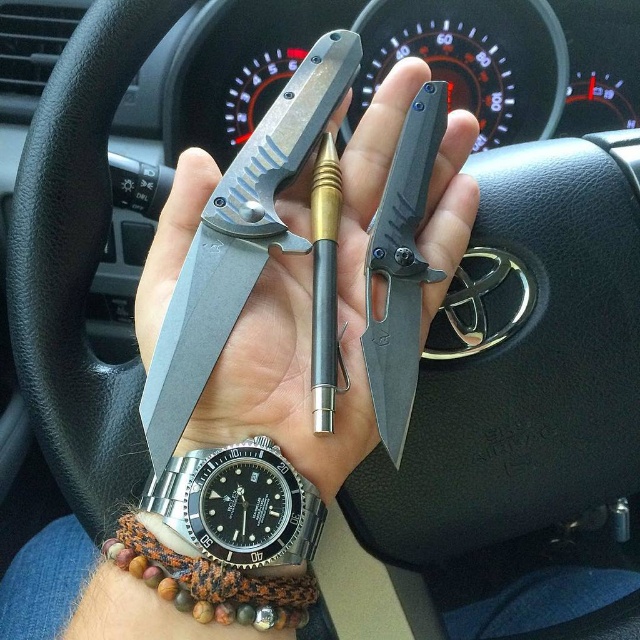
Question: Which object is closer to the camera taking this photo?

Choices:
 (A) black matte knife at center
 (B) satin steel watch at lower left
 (C) matte black knife at center

Answer: (B)

Question: Can you confirm if satin steel watch at lower left is positioned to the right of black matte knife at center?

Choices:
 (A) no
 (B) yes

Answer: (A)

Question: Which of the following is the farthest from the observer?

Choices:
 (A) black matte knife at center
 (B) matte black knife at center
 (C) satin steel watch at lower left

Answer: (A)

Question: Estimate the real-world distances between objects in this image. Which object is closer to the matte black knife at center?

Choices:
 (A) black matte knife at center
 (B) satin steel watch at lower left

Answer: (A)

Question: From the image, what is the correct spatial relationship of satin steel watch at lower left in relation to black matte knife at center?

Choices:
 (A) right
 (B) left

Answer: (B)

Question: Is satin steel watch at lower left positioned behind black matte knife at center?

Choices:
 (A) yes
 (B) no

Answer: (B)